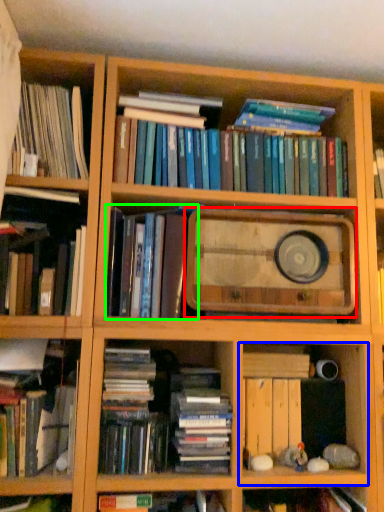
Question: Which object is positioned farthest from paperback book (highlighted by a red box)? Select from cabinet (highlighted by a blue box) and book (highlighted by a green box).

Choices:
 (A) cabinet
 (B) book

Answer: (A)